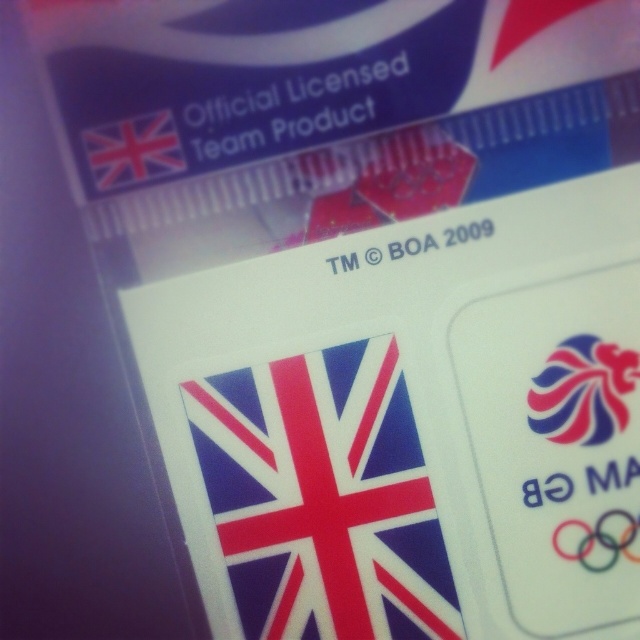
Question: Is matte plastic flag at center positioned in front of matte plastic flag at upper left?

Choices:
 (A) no
 (B) yes

Answer: (A)

Question: Which of the following is the closest to the observer?

Choices:
 (A) matte plastic flag at center
 (B) matte plastic flag at upper left

Answer: (B)

Question: Which of the following is the closest to the observer?

Choices:
 (A) matte plastic flag at center
 (B) matte plastic flag at upper left
 (C) blue glossy logo at upper right

Answer: (B)

Question: Does blue glossy logo at upper right appear over matte plastic flag at upper left?

Choices:
 (A) no
 (B) yes

Answer: (A)

Question: Is matte plastic flag at center closer to the viewer compared to blue glossy logo at upper right?

Choices:
 (A) no
 (B) yes

Answer: (A)

Question: Estimate the real-world distances between objects in this image. Which object is farther from the matte plastic flag at center?

Choices:
 (A) blue glossy logo at upper right
 (B) matte plastic flag at upper left

Answer: (B)